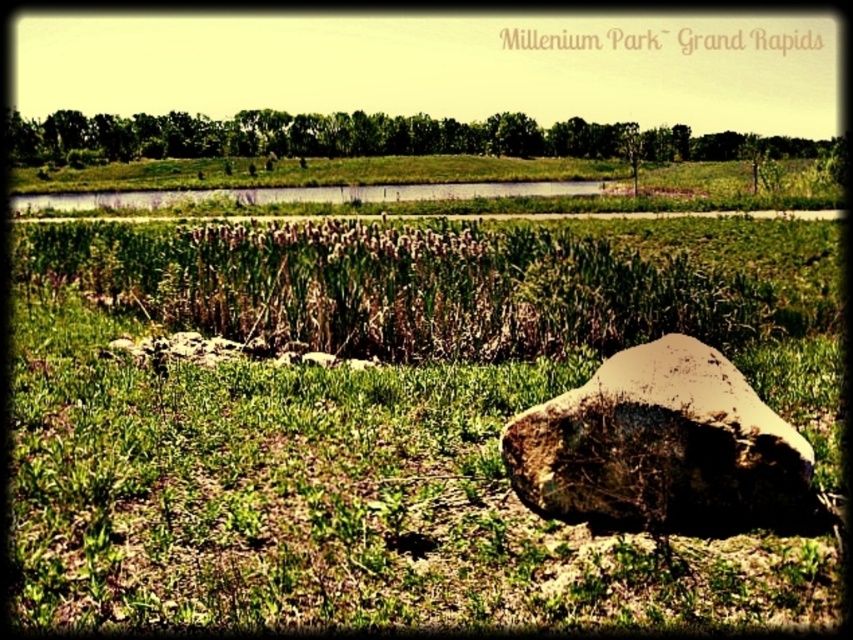
Question: Does green grassy at center appear on the left side of brown rough rock at center?

Choices:
 (A) yes
 (B) no

Answer: (A)

Question: Can you confirm if green grassy at center is positioned to the right of brown rough rock at center?

Choices:
 (A) yes
 (B) no

Answer: (B)

Question: Which point is farther to the camera?

Choices:
 (A) brown rough rock at center
 (B) green grassy at center

Answer: (A)

Question: Is green grassy at center thinner than brown rough rock at center?

Choices:
 (A) no
 (B) yes

Answer: (A)